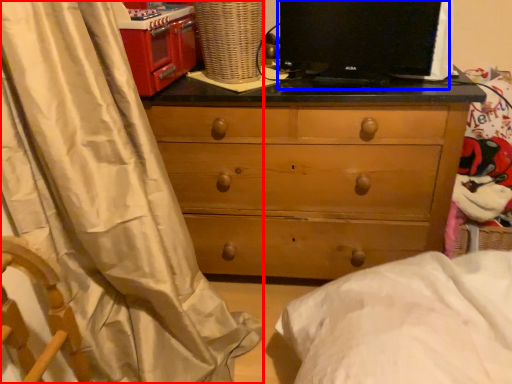
Question: Which of the following is the closest to the observer, curtain (highlighted by a red box) or computer monitor (highlighted by a blue box)?

Choices:
 (A) curtain
 (B) computer monitor

Answer: (A)